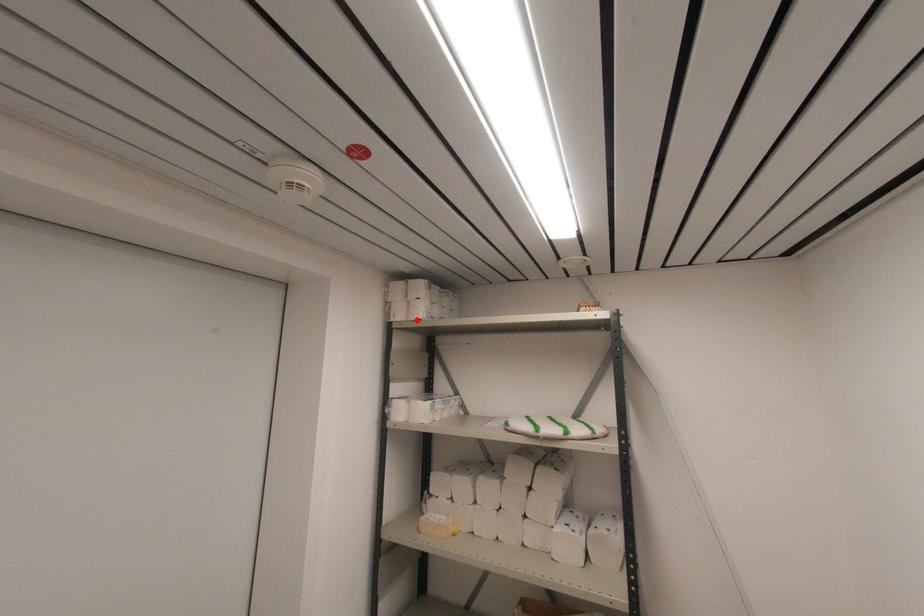
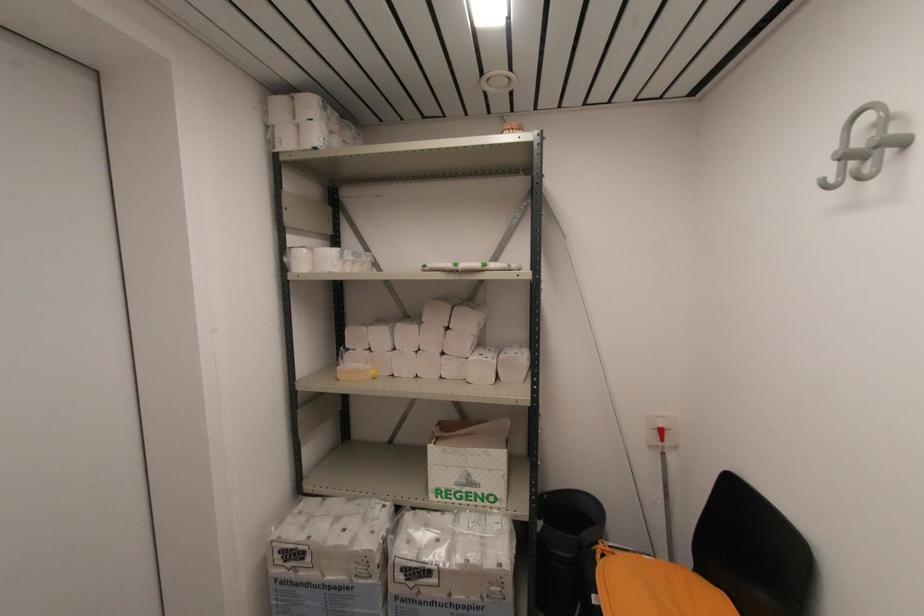
In the second image, find the point that corresponds to the highlighted location in the first image.

(310, 148)